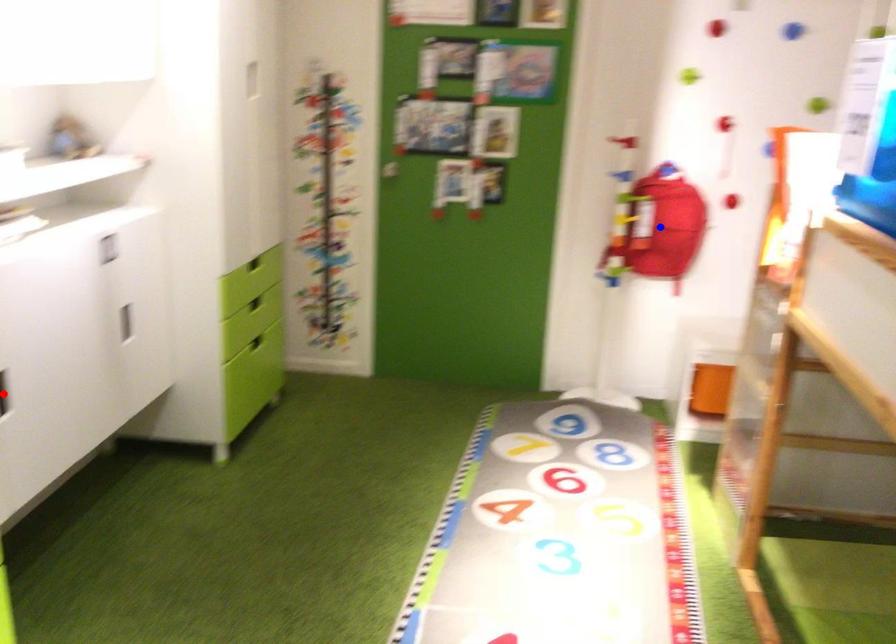
Question: Which of the two points in the image is closer to the camera?

Choices:
 (A) Blue point is closer.
 (B) Red point is closer.

Answer: (B)